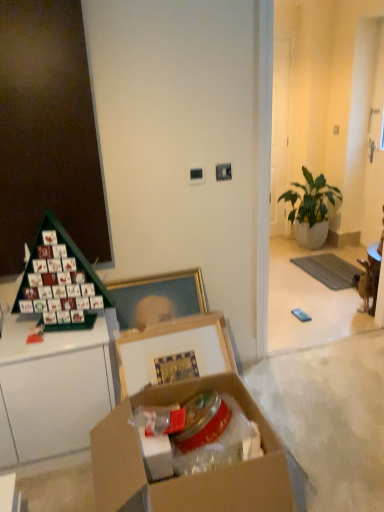
Question: Is cardboard box at center situated inside green leafy plant in white pot at right or outside?

Choices:
 (A) inside
 (B) outside

Answer: (B)

Question: Looking at the image, does cardboard box at center seem bigger or smaller compared to green leafy plant in white pot at right?

Choices:
 (A) small
 (B) big

Answer: (A)

Question: From a real-world perspective, is cardboard box at center positioned above or below green leafy plant in white pot at right?

Choices:
 (A) above
 (B) below

Answer: (B)

Question: Does point (317, 240) appear closer or farther from the camera than point (162, 507)?

Choices:
 (A) closer
 (B) farther

Answer: (B)

Question: Considering their positions, is green leafy plant in white pot at right located in front of or behind cardboard box at center?

Choices:
 (A) behind
 (B) front

Answer: (A)

Question: From the image's perspective, is green leafy plant in white pot at right located above or below cardboard box at center?

Choices:
 (A) above
 (B) below

Answer: (A)

Question: Based on their sizes in the image, would you say green leafy plant in white pot at right is bigger or smaller than cardboard box at center?

Choices:
 (A) small
 (B) big

Answer: (B)